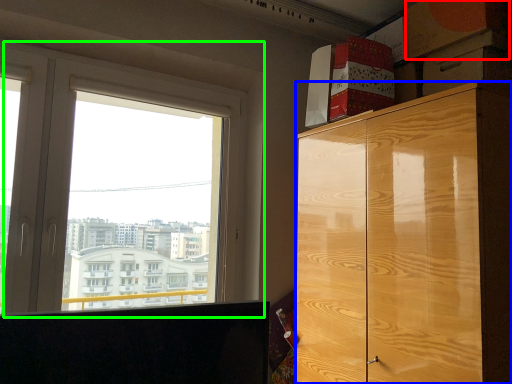
Question: Which is farther away from cardboard box (highlighted by a red box)? cabinetry (highlighted by a blue box) or window (highlighted by a green box)?

Choices:
 (A) cabinetry
 (B) window

Answer: (B)